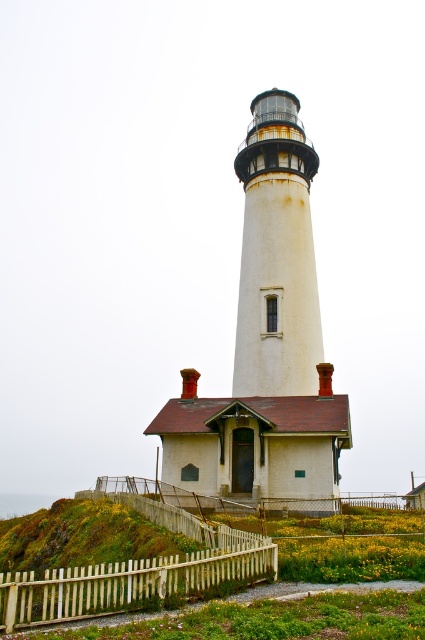
You are a bird flying over the area and want to land on the white textured lighthouse at center. Considering the green grass at lower center is nearby, can you safely land on the lighthouse without touching the grass?

The white textured lighthouse at center is much taller than the green grass at lower center, so you can safely land on the lighthouse without touching the grass.

You are standing at the base of the lighthouse and want to reach the point marked at coordinates point (204, 449). If you walk straight ahead, will you reach that point before walking 40 meters?

The point (204, 449) is 37.93 meters away from the viewer, so yes, you will reach it before walking 40 meters.

You are standing at the point marked by coordinates point (266, 340) in the image. Looking around, what large structure would you be inside of?

You are inside the white painted wood lighthouse at center, as the point (266, 340) represents its location.